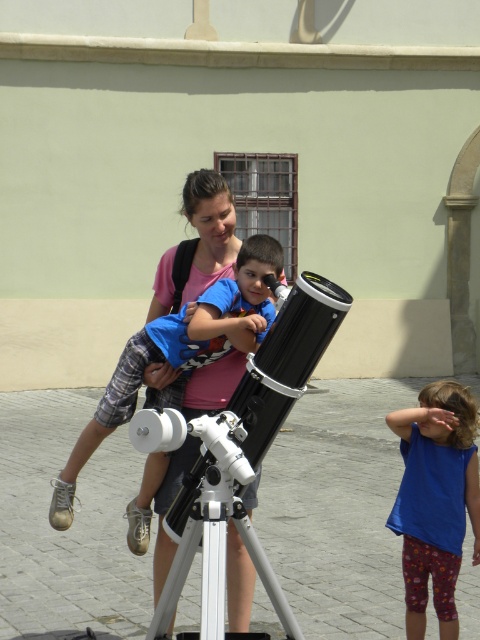
Where is the blue cotton shirt at center located in the image?

The blue cotton shirt at center is located at point coordinates of (186,342).

What is the relationship in height between the blue cotton shirt at center and the blue fabric shirt at center?

The blue cotton shirt at center is much taller than the blue fabric shirt at center.